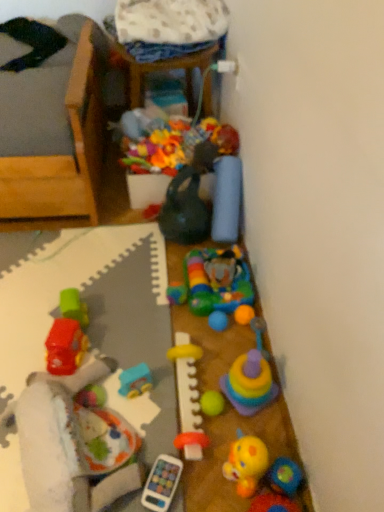
Image resolution: width=384 pixels, height=512 pixels. In order to click on vacant space that's between green rubber ball at center, which appears as the 5th toy when viewed from the left, and rubber duck at center, which is the 7th toy in left-to-right order in this screenshot , I will do [x=228, y=432].